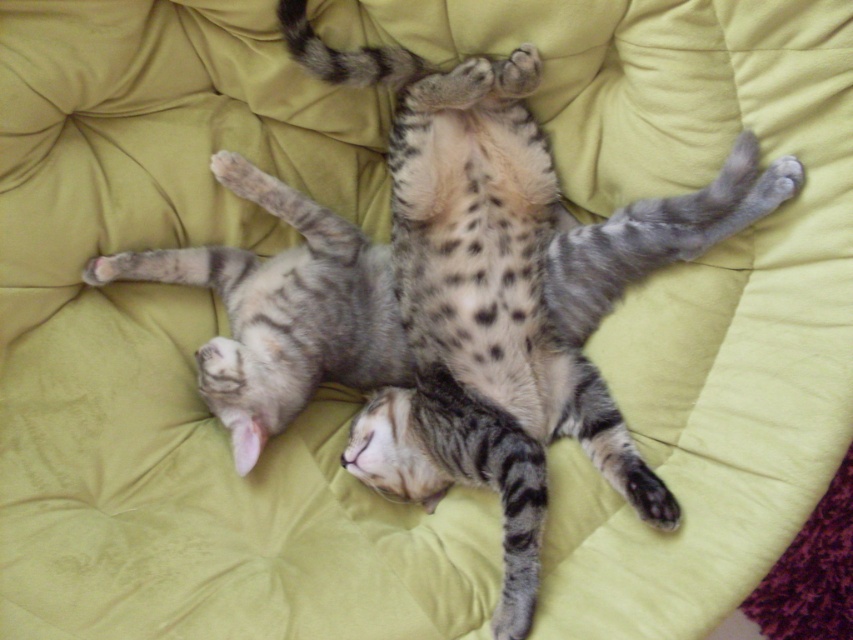
Is point (532, 131) positioned after point (282, 301)?

That is False.

Does spotted fur cat at center appear on the left side of tabby fur cat at center?

In fact, spotted fur cat at center is to the right of tabby fur cat at center.

Where is `spotted fur cat at center`? spotted fur cat at center is located at coordinates (509, 292).

Locate an element on the screen. The width and height of the screenshot is (853, 640). spotted fur cat at center is located at coordinates (509, 292).